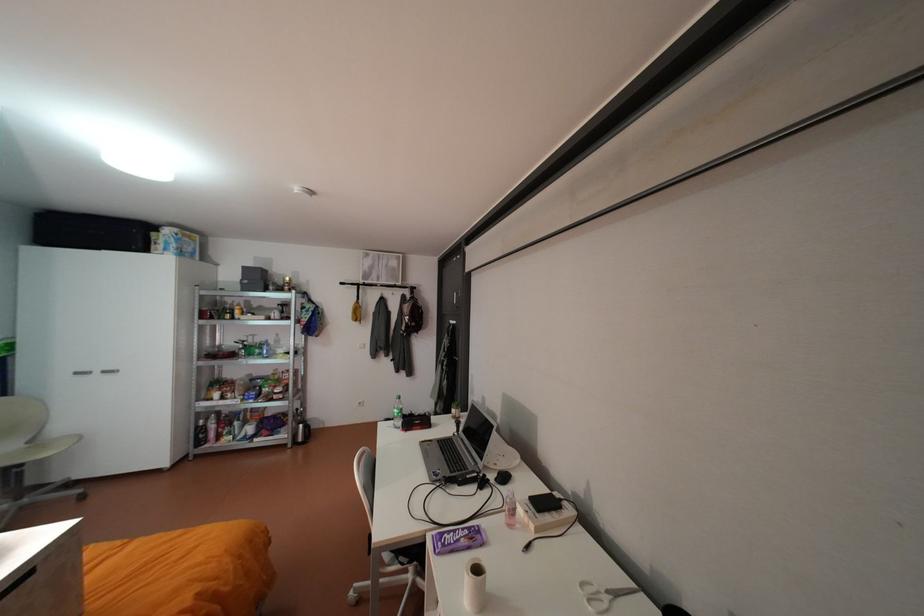
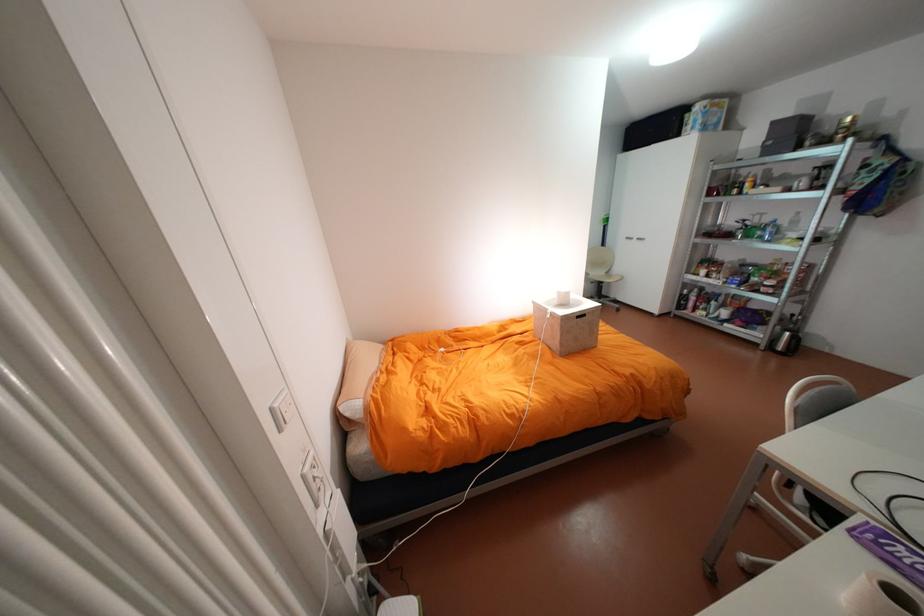
The images are taken continuously from a first-person perspective. In which direction is your viewpoint rotating?

The camera's rotation is toward left-down.